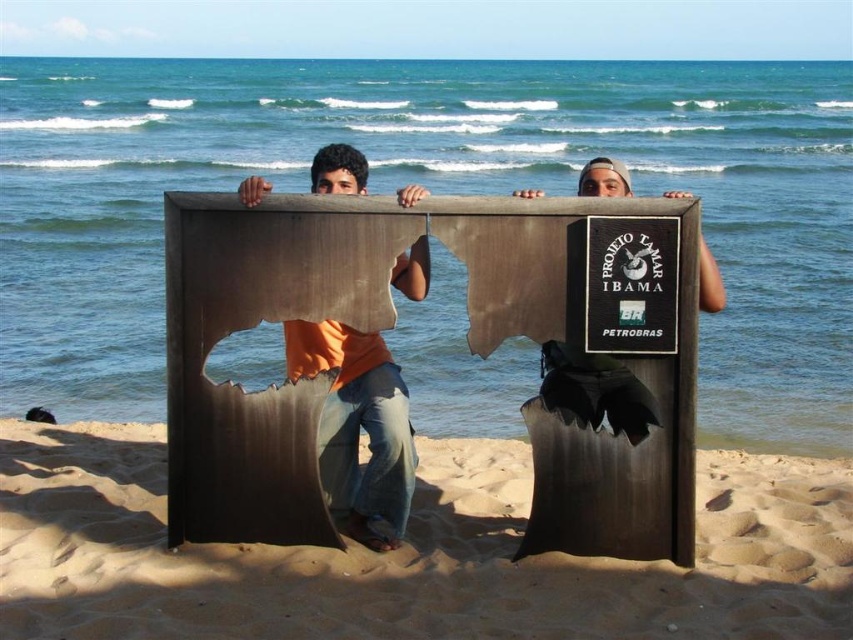
Can you confirm if sandy brown sand at lower center is positioned to the left of orange fabric at center?

In fact, sandy brown sand at lower center is to the right of orange fabric at center.

Is point (177, 552) positioned behind point (408, 460)?

No, (177, 552) is closer to viewer.

Find the location of `sandy brown sand at lower center`. sandy brown sand at lower center is located at coordinates (408, 556).

Does sandy brown sand at lower center have a greater height compared to black cardboard sign at center?

No.

Is sandy brown sand at lower center below black cardboard sign at center?

Yes.

You are a GUI agent. You are given a task and a screenshot of the screen. Output one action in this format:
    pyautogui.click(x=<x>, y=<y>)
    Task: Click on the sandy brown sand at lower center
    
    Given the screenshot: What is the action you would take?
    pyautogui.click(x=408, y=556)

Image resolution: width=853 pixels, height=640 pixels. Identify the location of sandy brown sand at lower center. (408, 556).

Who is higher up, orange fabric at center or black cardboard sign at center?

Positioned higher is orange fabric at center.

Which is behind, point (363, 540) or point (618, 266)?

The point (363, 540) is more distant.

Where is `orange fabric at center`? This screenshot has width=853, height=640. orange fabric at center is located at coordinates (358, 428).